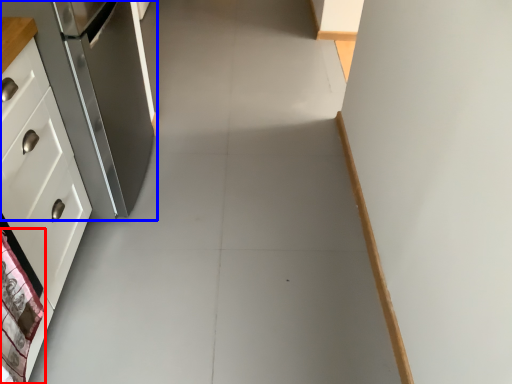
Question: Which object is closer to the camera taking this photo, material (highlighted by a red box) or refrigerator (highlighted by a blue box)?

Choices:
 (A) material
 (B) refrigerator

Answer: (A)